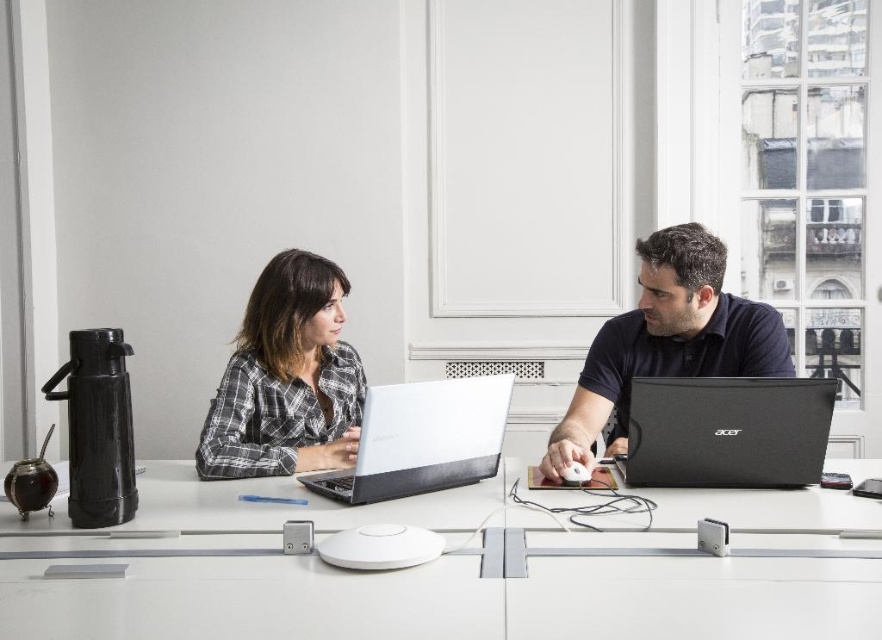
You are an office assistant who needs to place a new item on the table between the plaid fabric shirt at center and the black matte laptop at center. The item is 15 cm wide. Can you fit it there without moving either object?

The plaid fabric shirt at center has a lesser width compared to the black matte laptop at center. Since the plaid fabric shirt is narrower, there might be enough space between them to fit a 15 cm item, but this depends on their exact positions. However, based on the width comparison alone, the space between them could potentially accommodate the item if positioned correctly.